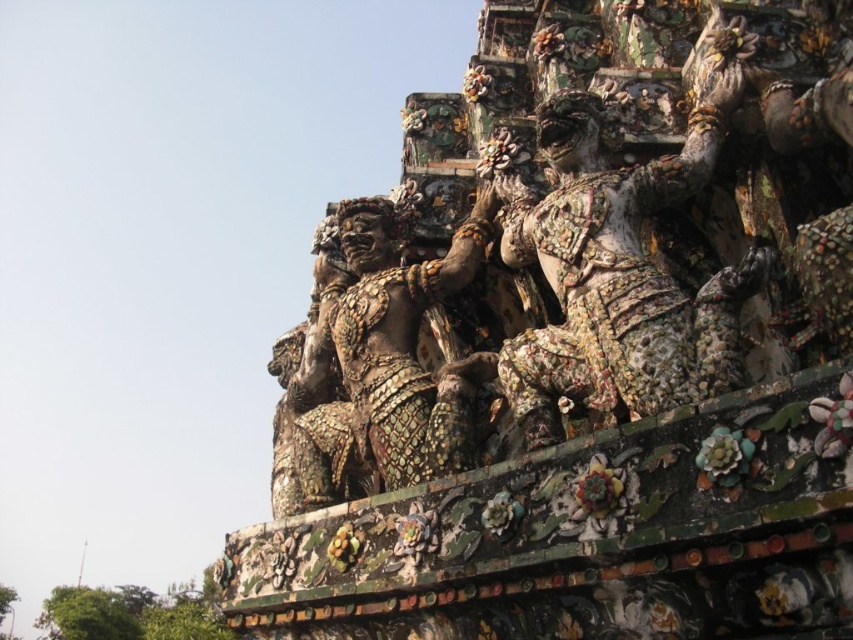
Question: Which of the following is the farthest from the observer?

Choices:
 (A) (711, 337)
 (B) (300, 340)

Answer: (B)

Question: Does multicolored mosaic warrior at center appear on the right side of gold mosaic statue at center?

Choices:
 (A) no
 (B) yes

Answer: (B)

Question: Does multicolored mosaic warrior at center have a lesser width compared to gold mosaic statue at center?

Choices:
 (A) no
 (B) yes

Answer: (B)

Question: Is multicolored mosaic warrior at center further to the viewer compared to gold mosaic statue at center?

Choices:
 (A) yes
 (B) no

Answer: (B)